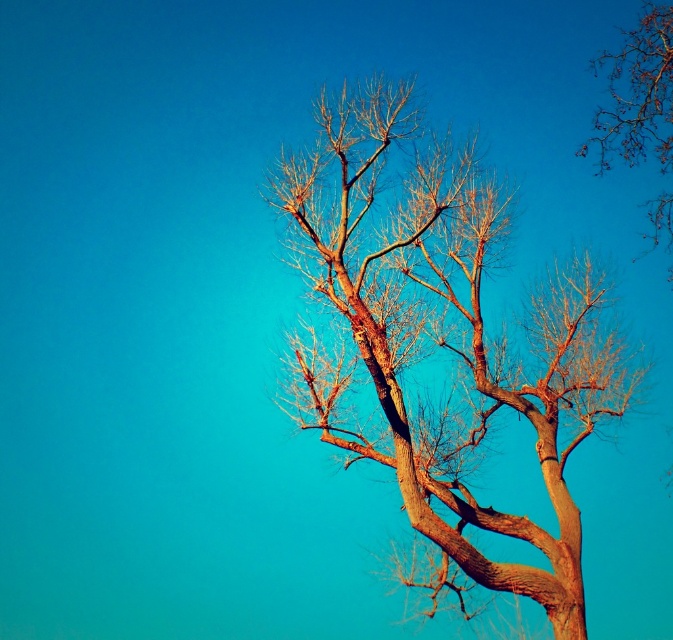
Is brown textured tree at center positioned at the back of bare branches at upper right?

No, it is in front of bare branches at upper right.

Is point (581, 349) closer to camera compared to point (608, 109)?

Yes, it is.

You are a GUI agent. You are given a task and a screenshot of the screen. Output one action in this format:
    pyautogui.click(x=<x>, y=<y>)
    Task: Click on the brown textured tree at center
    This screenshot has height=640, width=673.
    Given the screenshot: What is the action you would take?
    pyautogui.click(x=441, y=340)